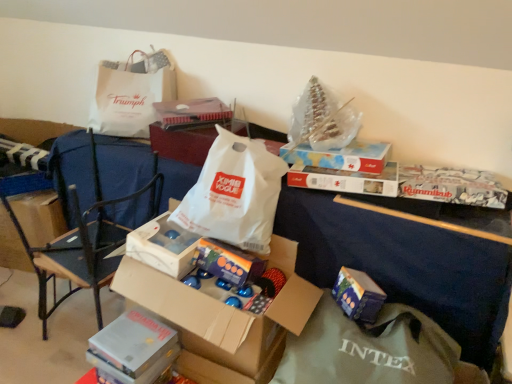
Image resolution: width=512 pixels, height=384 pixels. Find the location of `free point above metallic silver storage box at lower center, which is the fifth storage box from top to bottom (from a real-world perspective)`. free point above metallic silver storage box at lower center, which is the fifth storage box from top to bottom (from a real-world perspective) is located at coordinates (134, 336).